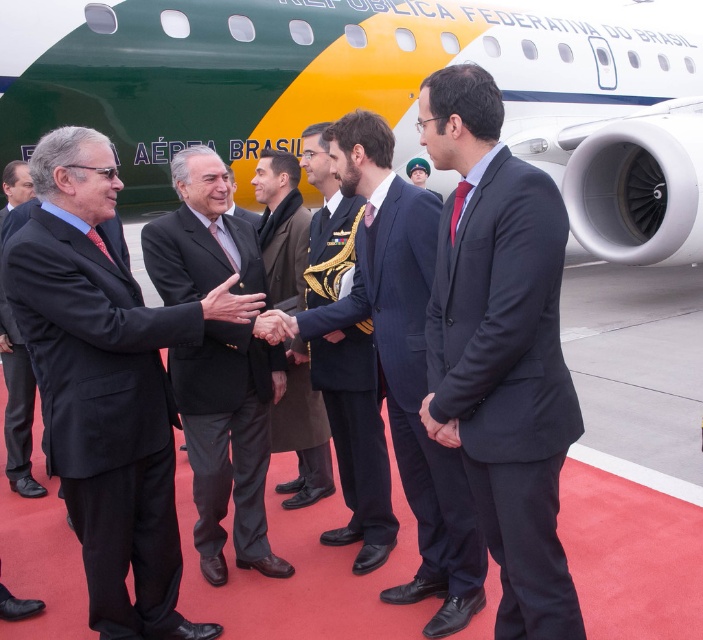
You are a photographer at the airport event and need to ensure both the black matte suit at center and the black wool suit at center are visible in your shot. Given that your camera has a fixed frame, which suit should you adjust your focus on to accommodate the wider one?

The black matte suit at center is wider than the black wool suit at center, so you should focus on the black matte suit at center to ensure it fits within the camera frame.